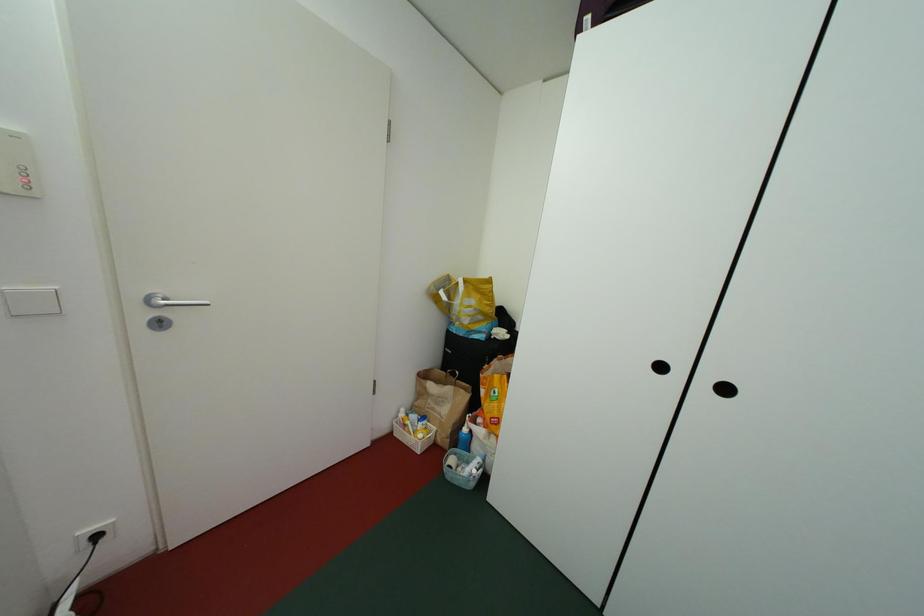
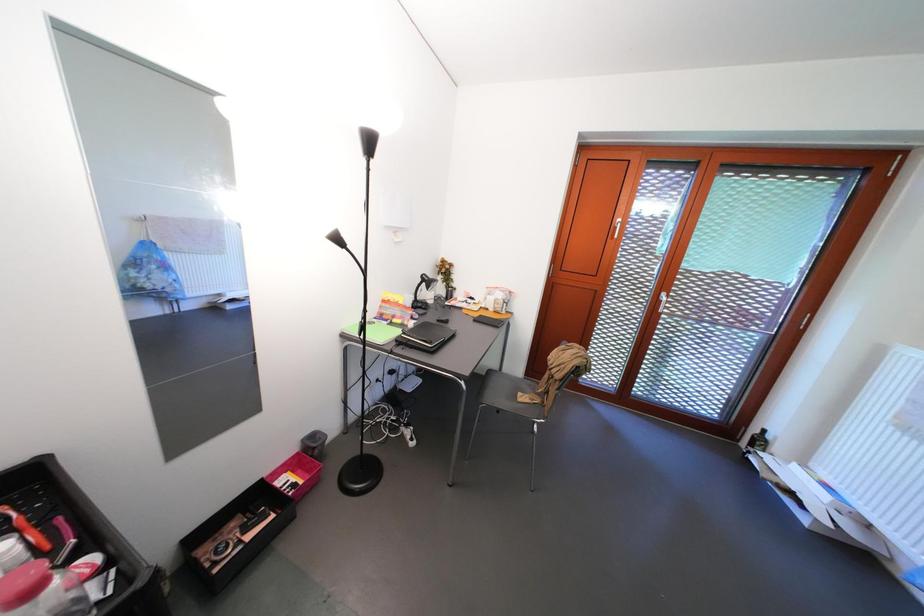
How did the camera likely rotate?

The rotation direction of the camera is right-down.